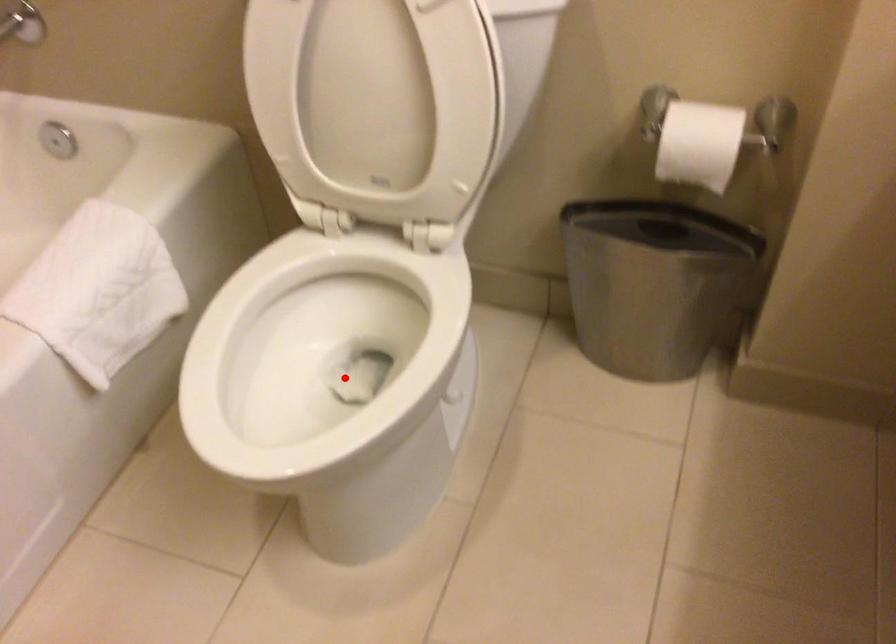
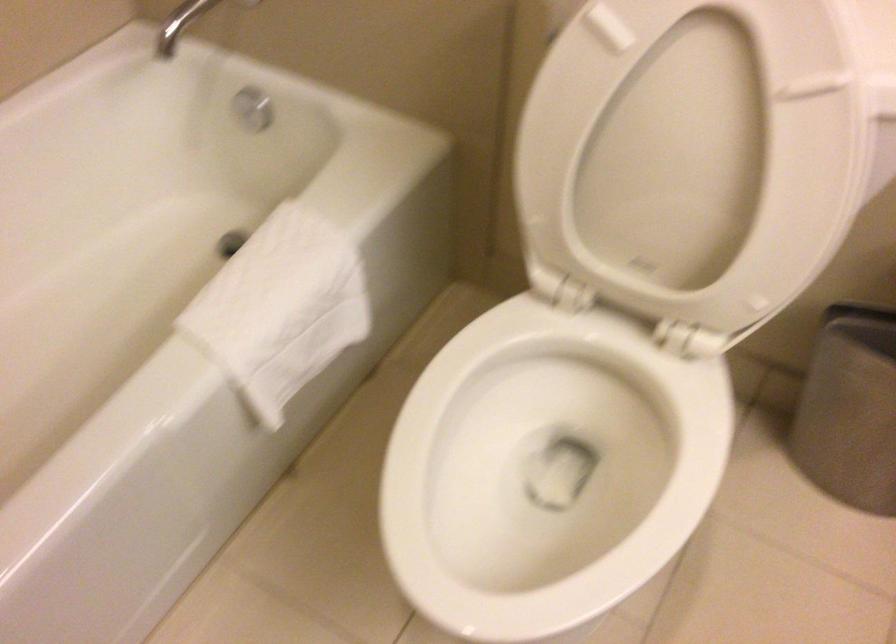
Find the pixel in the second image that matches the highlighted location in the first image.

(547, 469)